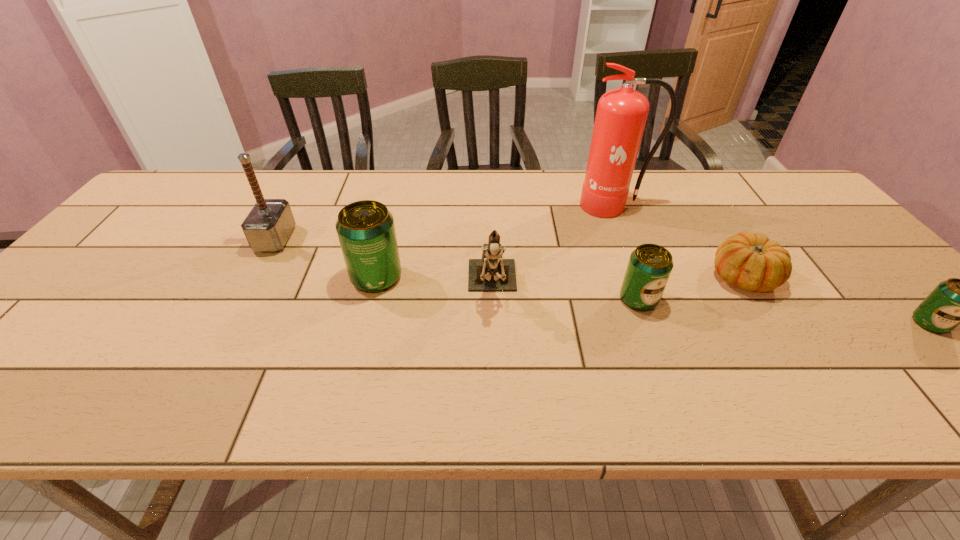
Image resolution: width=960 pixels, height=540 pixels. What are the coordinates of `object that is at the near edge` in the screenshot? It's located at (955, 301).

At what (x,y) coordinates should I click in order to perform the action: click on object at the right edge. Please return your answer as a coordinate pair (x, y). Looking at the image, I should click on (955, 301).

The width and height of the screenshot is (960, 540). In order to click on object that is at the near right corner in this screenshot , I will do `click(955, 301)`.

I want to click on vacant position at the far edge of the desktop, so click(x=670, y=177).

You are a GUI agent. You are given a task and a screenshot of the screen. Output one action in this format:
    pyautogui.click(x=<x>, y=<y>)
    Task: Click on the vacant space at the near edge of the desktop
    This screenshot has width=960, height=540.
    Given the screenshot: What is the action you would take?
    pyautogui.click(x=726, y=352)

In the image, there is a desktop. Identify the location of vacant space at the right edge. The height and width of the screenshot is (540, 960). (819, 236).

The image size is (960, 540). Identify the location of vacant space at the far left corner. (202, 182).

The width and height of the screenshot is (960, 540). What are the coordinates of `unoccupied position between the sixth object from left to right and the tallest object` in the screenshot? It's located at (679, 241).

You are a GUI agent. You are given a task and a screenshot of the screen. Output one action in this format:
    pyautogui.click(x=<x>, y=<y>)
    Task: Click on the vacant point located between the figurine and the farthest object
    Image resolution: width=960 pixels, height=540 pixels.
    Given the screenshot: What is the action you would take?
    pyautogui.click(x=553, y=246)

Identify the location of free space between the third object from left to right and the rightmost beer can. This screenshot has height=540, width=960. (711, 305).